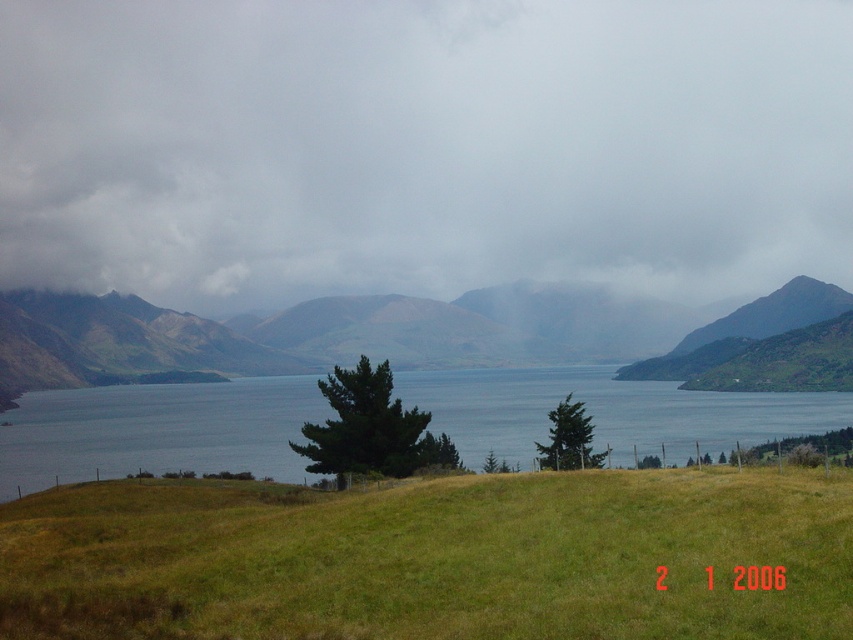
Does green grassy hill at lower center appear on the left side of blue water at center?

No, green grassy hill at lower center is not to the left of blue water at center.

Does green grassy hill at lower center appear over blue water at center?

Yes, green grassy hill at lower center is above blue water at center.

Locate an element on the screen. The width and height of the screenshot is (853, 640). green grassy hill at lower center is located at coordinates pos(432,557).

Is gray cloudy sky at upper center smaller than blue water at center?

Actually, gray cloudy sky at upper center might be larger than blue water at center.

Between point (161, 96) and point (815, 401), which one is positioned in front?

Point (815, 401) is more forward.

Identify the location of gray cloudy sky at upper center. (422, 147).

Does blue water at center have a larger size compared to green grassy mountain at center?

Indeed, blue water at center has a larger size compared to green grassy mountain at center.

At what (x,y) coordinates should I click in order to perform the action: click on blue water at center. Please return your answer as a coordinate pair (x, y). The image size is (853, 640). Looking at the image, I should click on (157, 429).

Does point (448, 381) come behind point (120, 352)?

No, it is not.

Image resolution: width=853 pixels, height=640 pixels. I want to click on blue water at center, so click(x=157, y=429).